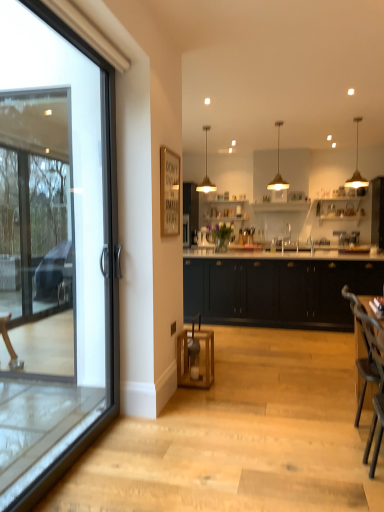
Question: Can you confirm if wooden armchair at right is thinner than gold metallic pendant light at upper center, acting as the third lamp starting from the right?

Choices:
 (A) no
 (B) yes

Answer: (B)

Question: Considering the relative positions of wooden armchair at right and gold metallic pendant light at upper center, acting as the third lamp starting from the right, in the image provided, is wooden armchair at right behind gold metallic pendant light at upper center, acting as the third lamp starting from the right,?

Choices:
 (A) yes
 (B) no

Answer: (B)

Question: Is wooden armchair at right oriented towards gold metallic pendant light at upper center, acting as the third lamp starting from the right?

Choices:
 (A) yes
 (B) no

Answer: (B)

Question: Is wooden armchair at right positioned with its back to gold metallic pendant light at upper center, acting as the third lamp starting from the right?

Choices:
 (A) no
 (B) yes

Answer: (A)

Question: From the image's perspective, is wooden armchair at right located beneath gold metallic pendant light at upper center, which is the 1th lamp in left-to-right order?

Choices:
 (A) no
 (B) yes

Answer: (B)

Question: Is wooden armchair at right far away from gold metallic pendant light at upper center, which is the 1th lamp in left-to-right order?

Choices:
 (A) yes
 (B) no

Answer: (A)

Question: Is wooden bar stool at center taller than matte gold pendant light at upper center, which ranks as the second lamp in left-to-right order?

Choices:
 (A) yes
 (B) no

Answer: (B)

Question: Does wooden bar stool at center have a greater width compared to matte gold pendant light at upper center, which ranks as the second lamp in left-to-right order?

Choices:
 (A) no
 (B) yes

Answer: (A)

Question: From a real-world perspective, is wooden bar stool at center located beneath matte gold pendant light at upper center, which appears as the 2th lamp when viewed from the right?

Choices:
 (A) no
 (B) yes

Answer: (B)

Question: Does wooden bar stool at center touch matte gold pendant light at upper center, which appears as the 2th lamp when viewed from the right?

Choices:
 (A) yes
 (B) no

Answer: (B)

Question: Is wooden bar stool at center thinner than matte gold pendant light at upper center, which appears as the 2th lamp when viewed from the right?

Choices:
 (A) no
 (B) yes

Answer: (B)

Question: Is wooden bar stool at center outside matte gold pendant light at upper center, which appears as the 2th lamp when viewed from the right?

Choices:
 (A) yes
 (B) no

Answer: (A)

Question: Does gold metallic pendant light at upper right, positioned as the first lamp in right-to-left order, have a larger size compared to gold metallic pendant light at upper center, acting as the third lamp starting from the right?

Choices:
 (A) yes
 (B) no

Answer: (A)